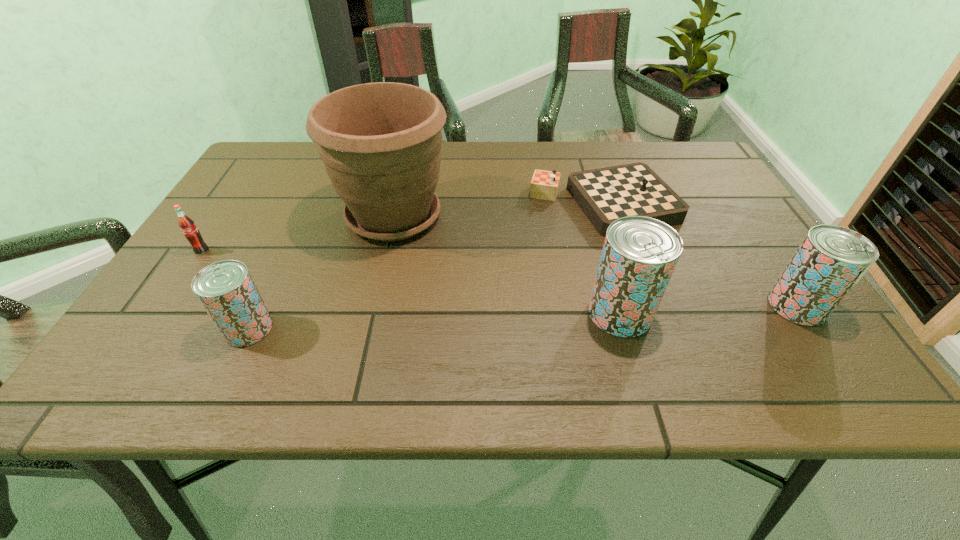
Where is `free point between the second tallest beer can and the second beer can from left to right`? The image size is (960, 540). free point between the second tallest beer can and the second beer can from left to right is located at coordinates (708, 309).

Locate an element on the screen. vacant space that's between the soda bottle and the second beer can from right to left is located at coordinates (411, 282).

Identify the location of unoccupied position between the shortest object and the leftmost beer can. The height and width of the screenshot is (540, 960). (426, 266).

Where is `empty space that is in between the leftmost beer can and the second tallest beer can`? This screenshot has height=540, width=960. empty space that is in between the leftmost beer can and the second tallest beer can is located at coordinates (523, 317).

You are a GUI agent. You are given a task and a screenshot of the screen. Output one action in this format:
    pyautogui.click(x=<x>, y=<y>)
    Task: Click on the free space between the fourth object from right to left and the chessboard
    The width and height of the screenshot is (960, 540).
    Given the screenshot: What is the action you would take?
    pyautogui.click(x=498, y=210)

Identify which object is located as the fourth nearest to the shortest object. Please provide its 2D coordinates. Your answer should be formatted as a tuple, i.e. [(x, y)], where the tuple contains the x and y coordinates of a point satisfying the conditions above.

[(226, 290)]

Where is `object that is the fifth closest to the third tallest object`? object that is the fifth closest to the third tallest object is located at coordinates (186, 224).

You are a GUI agent. You are given a task and a screenshot of the screen. Output one action in this format:
    pyautogui.click(x=<x>, y=<y>)
    Task: Click on the closest beer can to the fifth object from right to left
    
    Given the screenshot: What is the action you would take?
    click(x=639, y=255)

Locate an element on the screen. beer can that stands as the second closest to the second beer can from left to right is located at coordinates (226, 290).

I want to click on free spot that satisfies the following two spatial constraints: 1. on the label of the second tallest beer can; 2. on the right side of the soda bottle, so click(x=165, y=306).